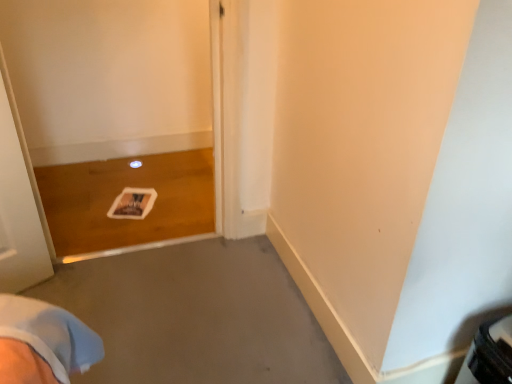
Question: Is point (178, 276) closer or farther from the camera than point (47, 11)?

Choices:
 (A) farther
 (B) closer

Answer: (B)

Question: Considering their positions, is gray matte concrete at center located in front of or behind white glossy door at lower left?

Choices:
 (A) behind
 (B) front

Answer: (B)

Question: Would you say gray matte concrete at center is inside or outside white glossy door at lower left?

Choices:
 (A) inside
 (B) outside

Answer: (B)

Question: Considering the relative positions of white glossy door at lower left and gray matte concrete at center in the image provided, is white glossy door at lower left to the left or to the right of gray matte concrete at center?

Choices:
 (A) left
 (B) right

Answer: (A)

Question: Does point (193, 230) appear closer or farther from the camera than point (126, 360)?

Choices:
 (A) farther
 (B) closer

Answer: (A)

Question: From the image's perspective, is white glossy door at lower left above or below gray matte concrete at center?

Choices:
 (A) below
 (B) above

Answer: (B)

Question: Is white glossy door at lower left wider or thinner than gray matte concrete at center?

Choices:
 (A) thin
 (B) wide

Answer: (A)